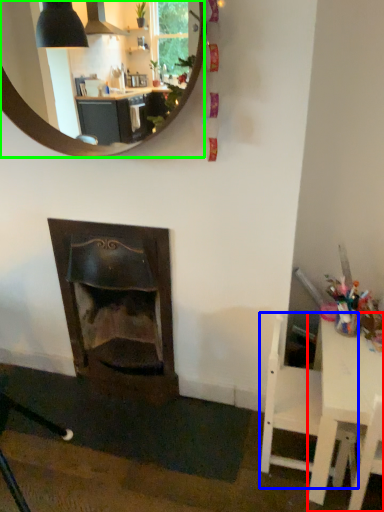
Question: Which object is the closest to the table (highlighted by a red box)? Choose among these: chair (highlighted by a blue box) or mirror (highlighted by a green box).

Choices:
 (A) chair
 (B) mirror

Answer: (A)